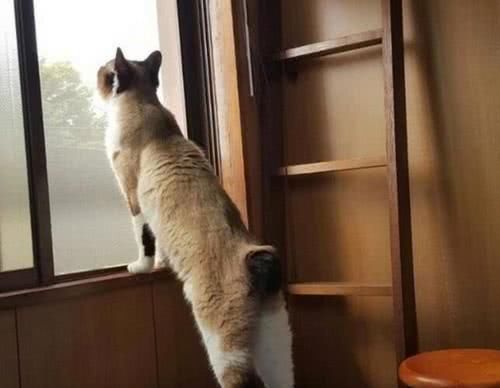
The width and height of the screenshot is (500, 388). I want to click on wooden ladder rungs, so click(x=350, y=291), click(x=335, y=166), click(x=329, y=44).